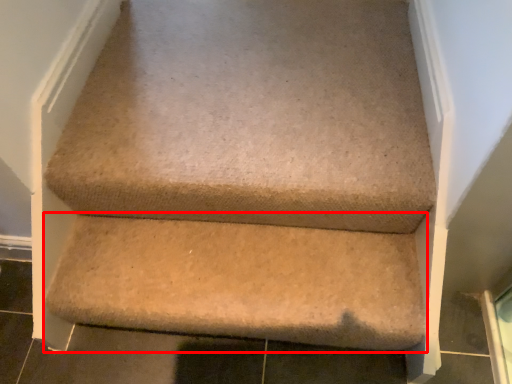
Question: Observing the image, what is the correct spatial positioning of stairwell (annotated by the red box) in reference to furniture?

Choices:
 (A) left
 (B) right

Answer: (A)